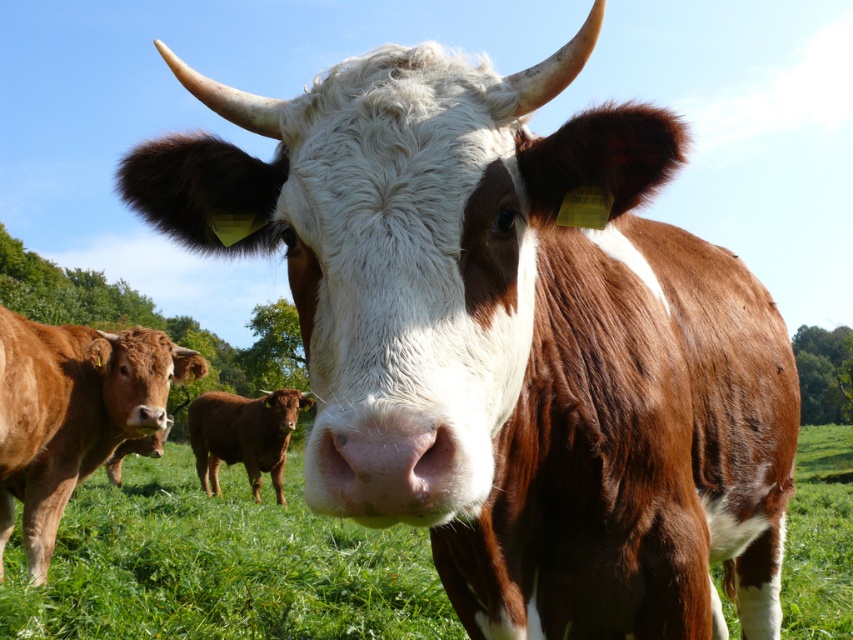
Question: Which of the following is the farthest from the observer?

Choices:
 (A) (50, 403)
 (B) (219, 420)

Answer: (B)

Question: Can you confirm if green grassy at center is wider than brown smooth cow at left?

Choices:
 (A) no
 (B) yes

Answer: (B)

Question: Which of the following is the farthest from the observer?

Choices:
 (A) green grassy at center
 (B) brown smooth cow at left
 (C) brown smooth cow at center

Answer: (C)

Question: Is green grassy at center in front of brown smooth cow at center?

Choices:
 (A) no
 (B) yes

Answer: (B)

Question: Can you confirm if green grassy at center is positioned below brown smooth cow at center?

Choices:
 (A) yes
 (B) no

Answer: (A)

Question: Which of these objects is positioned closest to the green grassy at center?

Choices:
 (A) brown smooth cow at center
 (B) brown smooth cow at left

Answer: (A)